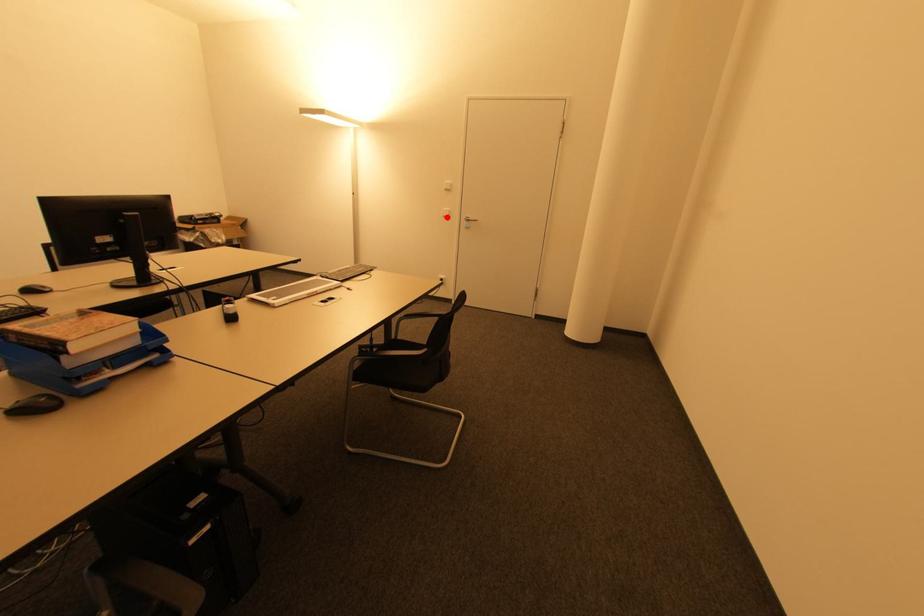
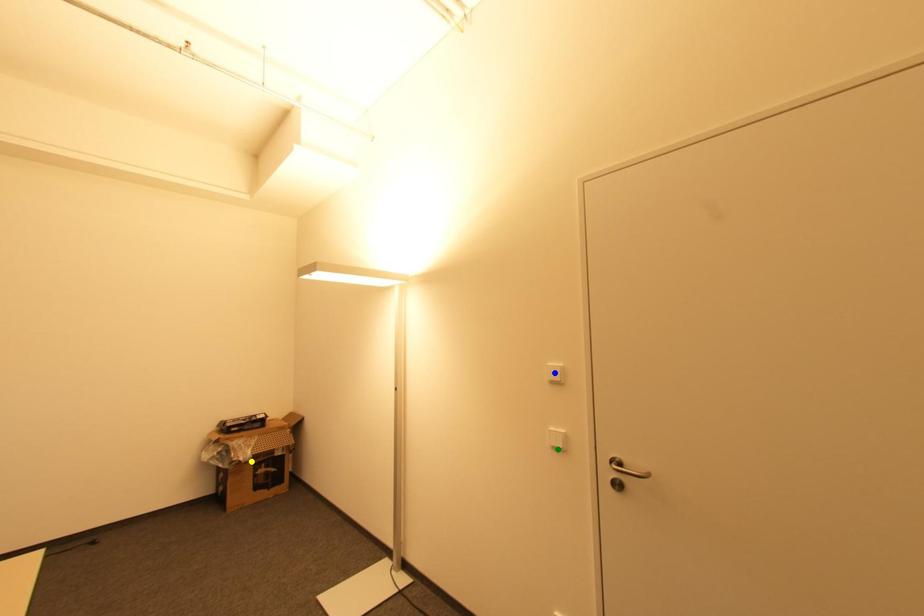
Question: I am providing you with two images of the same scene from different viewpoints. A red point is marked on the first image. You are given multiple points on the second image. Which mark in image 2 goes with the point in image 1?

Choices:
 (A) yellow point
 (B) blue point
 (C) green point

Answer: (C)